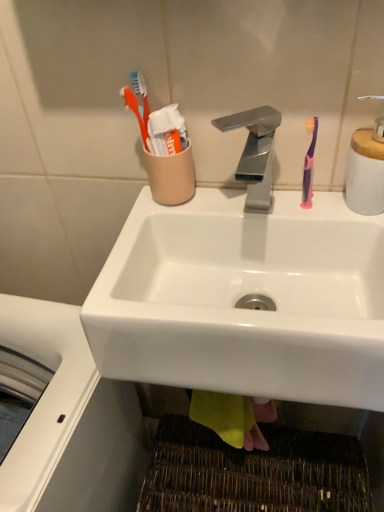
Identify the location of vacant area situated to the left side of white ceramic soap dispenser at upper right. (283, 210).